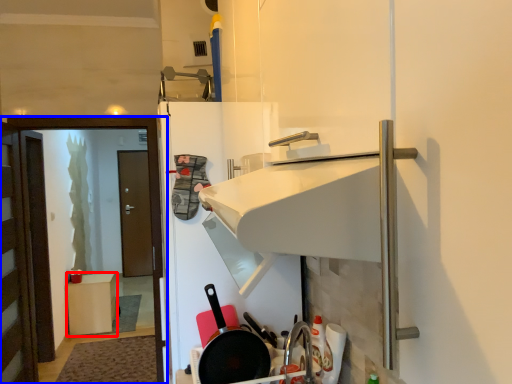
Question: Which point is closer to the camera, furniture (highlighted by a red box) or screen door (highlighted by a blue box)?

Choices:
 (A) furniture
 (B) screen door

Answer: (B)